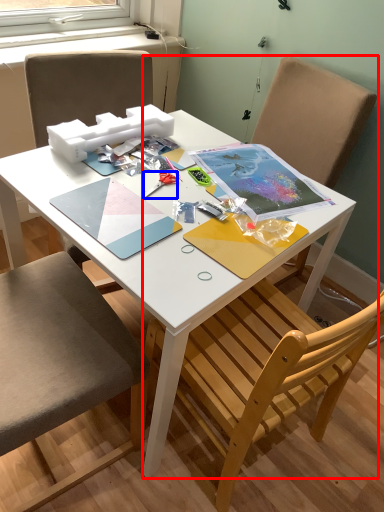
Question: Which object appears closest to the camera in this image, chair (highlighted by a red box) or scissors (highlighted by a blue box)?

Choices:
 (A) chair
 (B) scissors

Answer: (A)